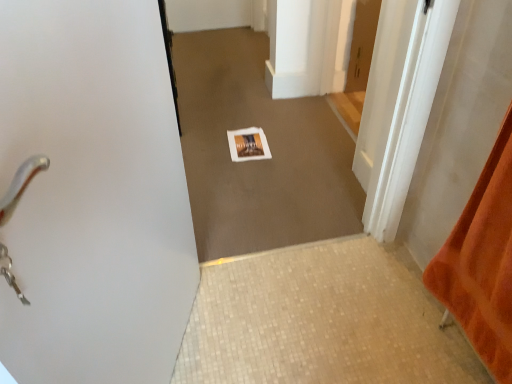
Identify the location of free point behind orange fabric at right. [402, 293].